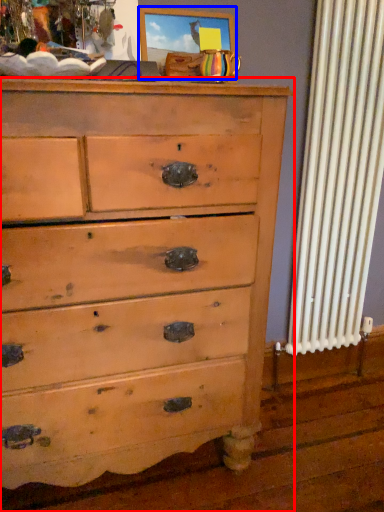
Question: Which point is further to the camera, chest of drawers (highlighted by a red box) or picture frame (highlighted by a blue box)?

Choices:
 (A) chest of drawers
 (B) picture frame

Answer: (B)